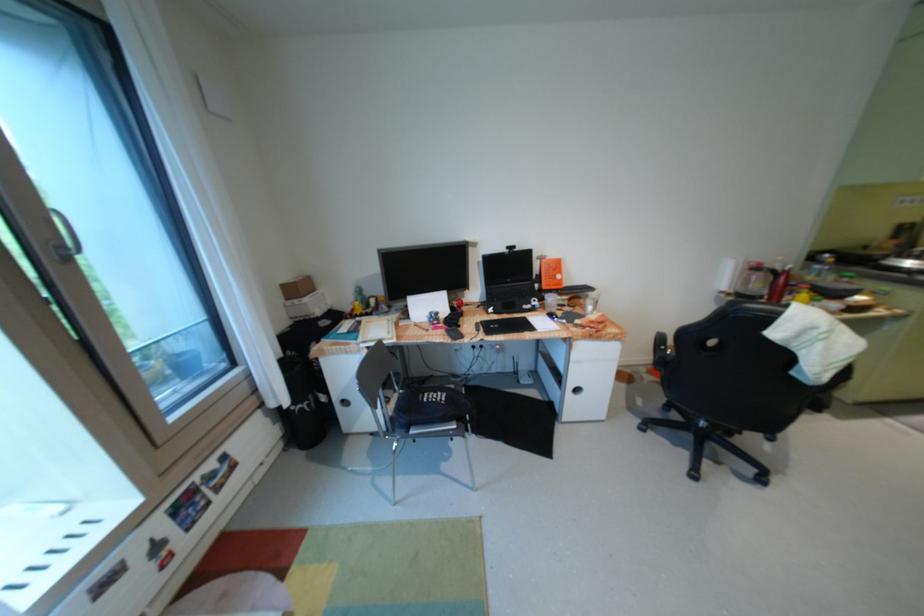
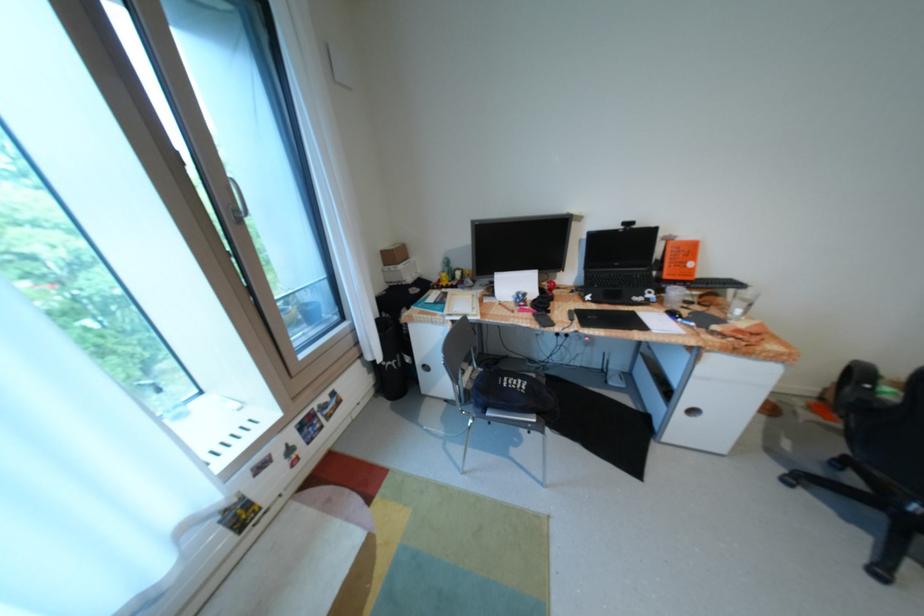
Find the pixel in the second image that matches point (73, 248) in the first image.

(247, 211)